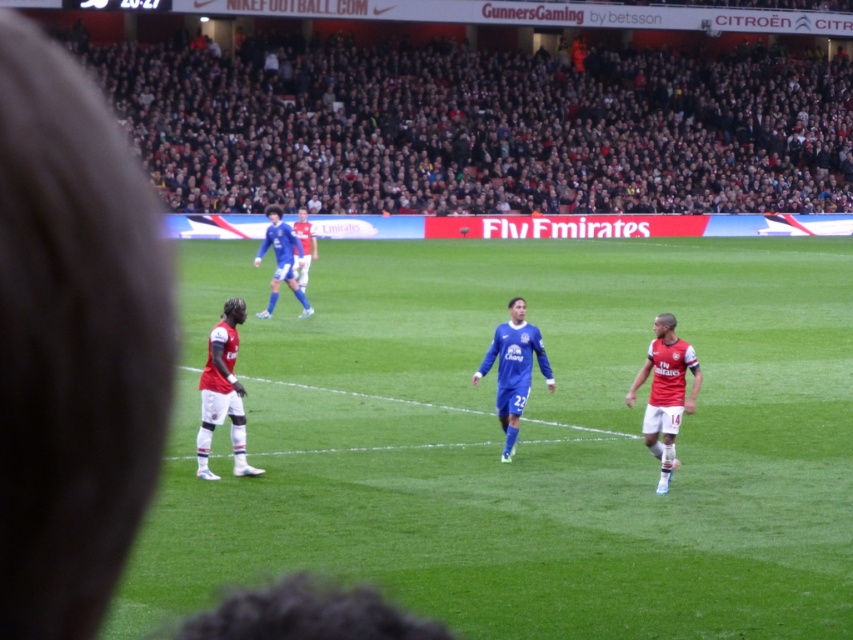
Is green grass field at center wider than blue jersey at center?

Indeed, green grass field at center has a greater width compared to blue jersey at center.

Who is taller, green grass field at center or blue jersey at center?

With more height is green grass field at center.

Does point (712, 632) come in front of point (500, 404)?

Yes, it is in front of point (500, 404).

At what (x,y) coordinates should I click in order to perform the action: click on green grass field at center. Please return your answer as a coordinate pair (x, y). This screenshot has height=640, width=853. Looking at the image, I should click on (521, 440).

Does green grass field at center appear on the left side of white jersey at left?

No, green grass field at center is not to the left of white jersey at left.

Who is positioned more to the right, green grass field at center or white jersey at left?

From the viewer's perspective, green grass field at center appears more on the right side.

Image resolution: width=853 pixels, height=640 pixels. What are the coordinates of `green grass field at center` in the screenshot? It's located at (521, 440).

Does green grass field at center have a larger size compared to blue smooth soccer player at center?

Yes, green grass field at center is bigger than blue smooth soccer player at center.

Between green grass field at center and blue smooth soccer player at center, which one has less height?

blue smooth soccer player at center is shorter.

Is point (656, 282) positioned behind point (283, 221)?

Yes, point (656, 282) is behind point (283, 221).

Image resolution: width=853 pixels, height=640 pixels. I want to click on green grass field at center, so click(x=521, y=440).